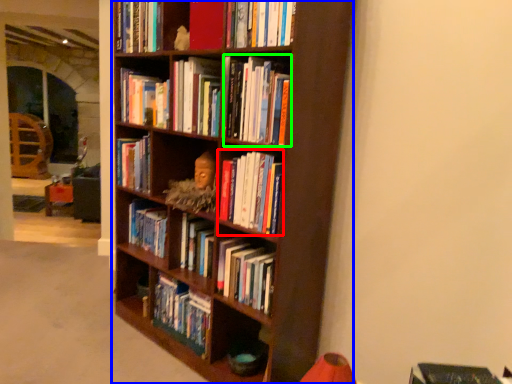
Question: Estimate the real-world distances between objects in this image. Which object is farther from book (highlighted by a red box), bookcase (highlighted by a blue box) or book (highlighted by a green box)?

Choices:
 (A) bookcase
 (B) book

Answer: (A)